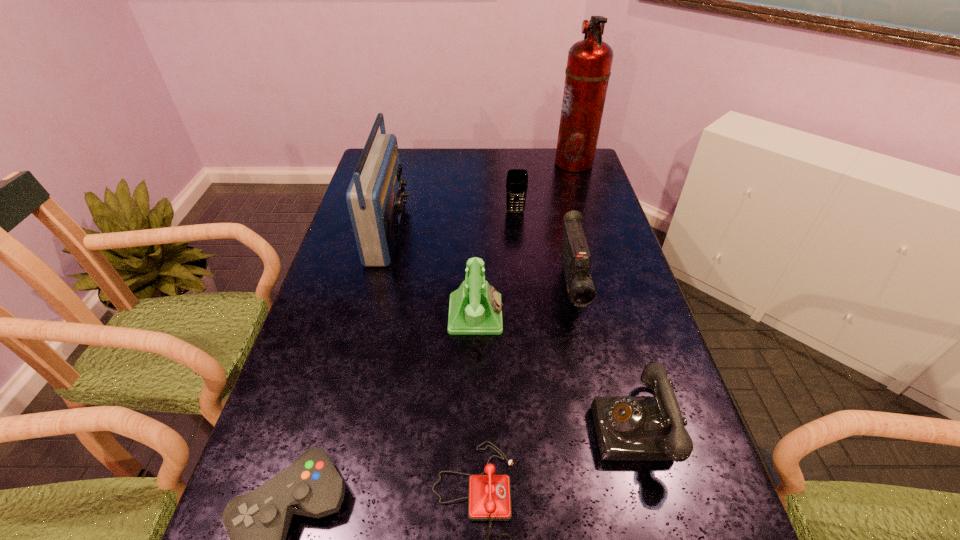
You are a GUI agent. You are given a task and a screenshot of the screen. Output one action in this format:
    pyautogui.click(x=<x>, y=<y>)
    Task: Click on the telephone identified as the second closest to the farthest telephone
    The image size is (960, 540).
    Given the screenshot: What is the action you would take?
    pyautogui.click(x=489, y=496)

Locate which telephone is the second closest to the shortest object. Please provide its 2D coordinates. Your answer should be formatted as a tuple, i.e. [(x, y)], where the tuple contains the x and y coordinates of a point satisfying the conditions above.

[(475, 308)]

You are a GUI agent. You are given a task and a screenshot of the screen. Output one action in this format:
    pyautogui.click(x=<x>, y=<y>)
    Task: Click on the free space in the image that satisfies the following two spatial constraints: 1. on the nozzle side of the fire extinguisher; 2. on the front-facing side of the camcorder
    Image resolution: width=960 pixels, height=540 pixels.
    Given the screenshot: What is the action you would take?
    pyautogui.click(x=613, y=289)

At what (x,y) coordinates should I click in order to perform the action: click on free space that satisfies the following two spatial constraints: 1. on the front-facing side of the camcorder; 2. on the dial of the farthest telephone. Please return your answer as a coordinate pair (x, y). This screenshot has width=960, height=540. Looking at the image, I should click on (577, 314).

At what (x,y) coordinates should I click in order to perform the action: click on vacant space that satisfies the following two spatial constraints: 1. on the nozzle side of the fire extinguisher; 2. on the screen of the fifth object from left to right. Please return your answer as a coordinate pair (x, y). The image size is (960, 540). Looking at the image, I should click on (589, 212).